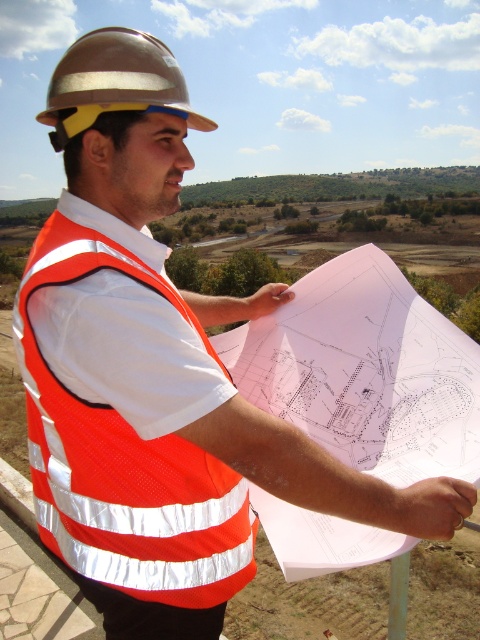
From the picture: You are a construction worker looking at the reflective orange safety vest at center and the metallic hard hat at upper left. Which object is shorter?

The reflective orange safety vest at center is shorter than the metallic hard hat at upper left.

You are a construction worker reviewing the blueprint in the image. There is a point marked at coordinates (124, 460) on the map. What object on your person does this point most likely represent?

The point at coordinates (124, 460) corresponds to the reflective orange safety vest at center, which is part of your attire.